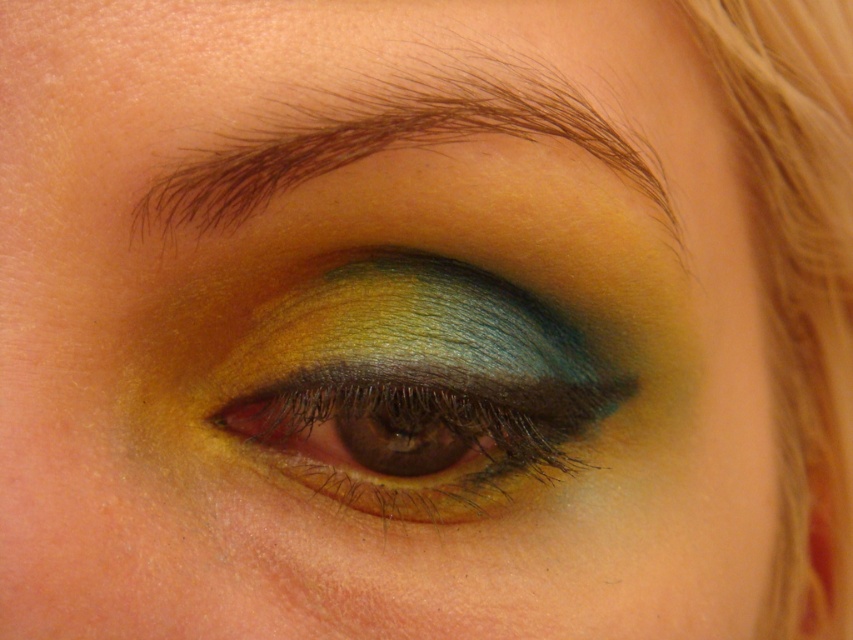
You are an artist analyzing the makeup in the image. You notice a point at coordinates (415, 388). Based on the eye makeup described, where is this point located?

The point at coordinates (415, 388) corresponds to the metallic shimmering eye at center.

Based on the photo, you are an artist analyzing the eye makeup in the image. You notice two points marked on the eyelid. The first point is at coordinates point (x=485, y=426) and the second is at point (x=282, y=168). Which of these points is closer to the viewer?

Point (x=282, y=168) is closer to the viewer since it is in front of point (x=485, y=426) according to the spatial relationship provided.